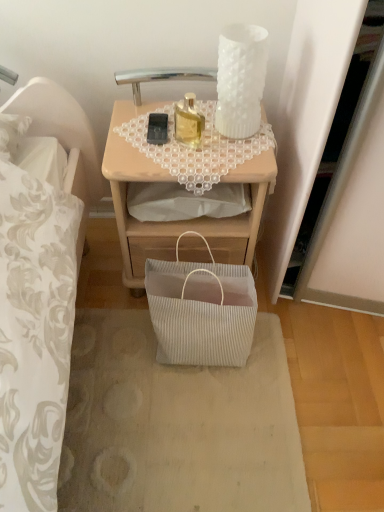
Question: Looking at the image, does white pleated bag at lower center seem bigger or smaller compared to wooden desk at center?

Choices:
 (A) big
 (B) small

Answer: (B)

Question: Is white pleated bag at lower center inside the boundaries of wooden desk at center, or outside?

Choices:
 (A) outside
 (B) inside

Answer: (A)

Question: Which object is positioned closest to the translucent glass bottle at center?

Choices:
 (A) white pleated paper bag at lower center
 (B) black matte mobile phone at upper center
 (C) white pleated bag at lower center
 (D) wooden desk at center

Answer: (B)

Question: Which object is positioned farthest from the white pleated bag at lower center?

Choices:
 (A) black matte mobile phone at upper center
 (B) translucent glass bottle at center
 (C) white pleated paper bag at lower center
 (D) wooden desk at center

Answer: (A)